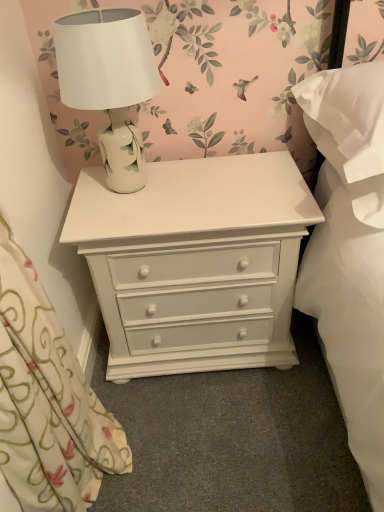
I want to click on free location above white painted wood chest of drawers at center (from a real-world perspective), so click(200, 184).